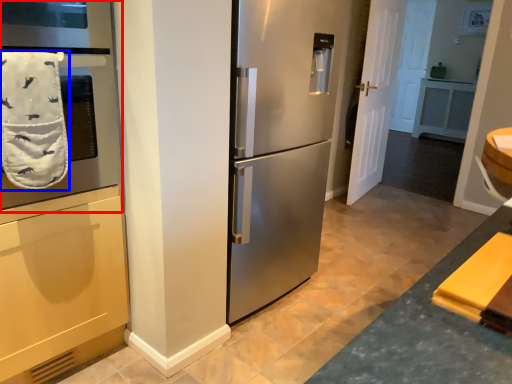
Question: Which object is closer to the camera taking this photo, oven (highlighted by a red box) or bath towel (highlighted by a blue box)?

Choices:
 (A) oven
 (B) bath towel

Answer: (A)